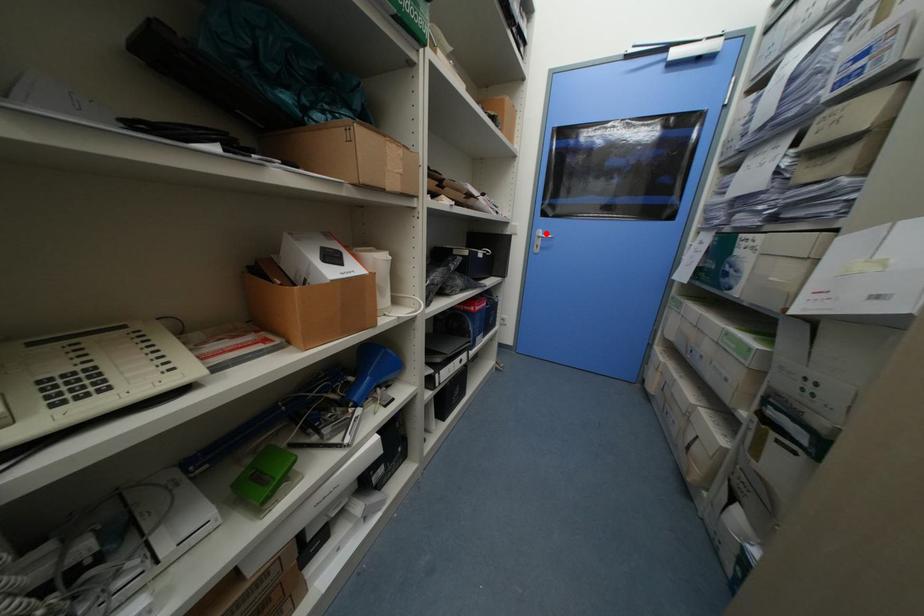
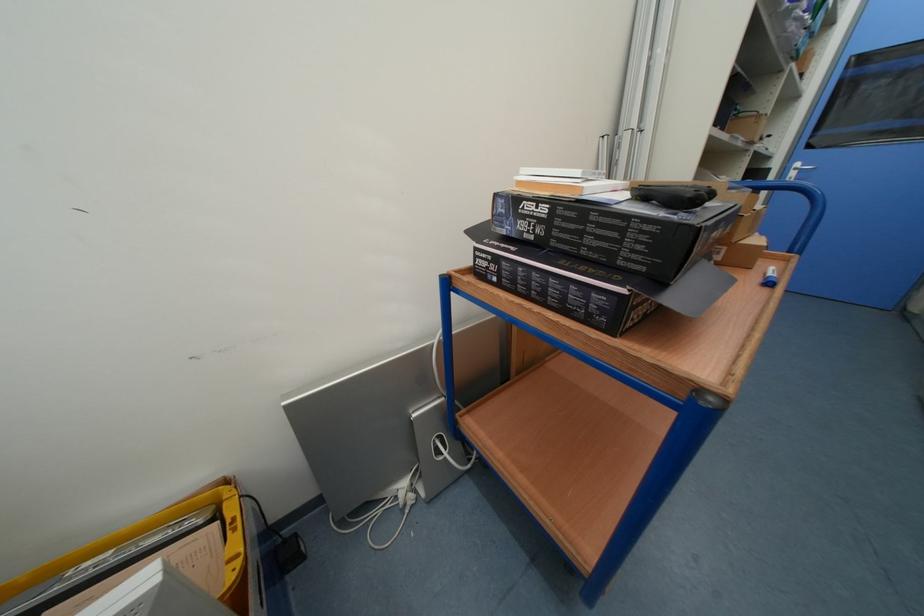
Where in the second image is the point corresponding to the highlighted location from the first image?

(804, 166)